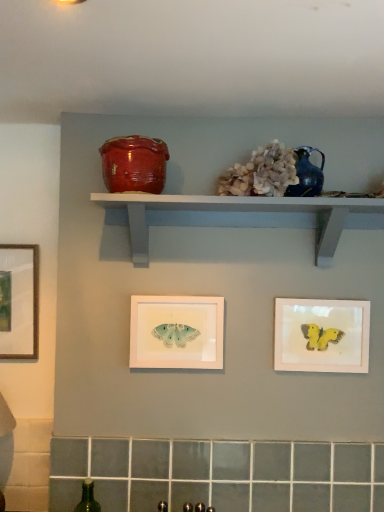
Question: From a real-world perspective, relative to white matte butterfly at center, which is the first picture frame from left to right, is matte pink picture frame at lower right, which ranks as the 2th picture frame in left-to-right order, vertically above or below?

Choices:
 (A) below
 (B) above

Answer: (B)

Question: In the image, is matte pink picture frame at lower right, which ranks as the first picture frame in right-to-left order, on the left side or the right side of white matte butterfly at center, the 2th picture frame viewed from the right?

Choices:
 (A) left
 (B) right

Answer: (B)

Question: Considering the real-world distances, which object is farthest from the glossy ceramic jar at upper center?

Choices:
 (A) white matte butterfly at center, which is the first picture frame from left to right
 (B) teal ceramic vase at upper center
 (C) matte pink picture frame at lower right, which ranks as the first picture frame in right-to-left order
 (D) white painted wood shelf at upper center

Answer: (C)

Question: Which of these objects is positioned farthest from the white matte butterfly at center, the 2th picture frame viewed from the right?

Choices:
 (A) glossy ceramic jar at upper center
 (B) teal ceramic vase at upper center
 (C) white painted wood shelf at upper center
 (D) matte pink picture frame at lower right, which ranks as the 2th picture frame in left-to-right order

Answer: (B)